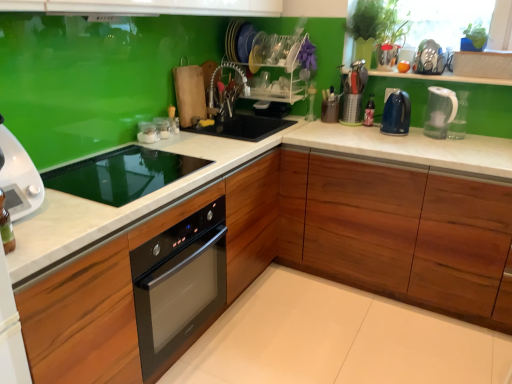
The width and height of the screenshot is (512, 384). Identify the location of free space in front of blue glossy electric kettle at upper right, which is counted as the 2th kitchen appliance, starting from the right. (402, 141).